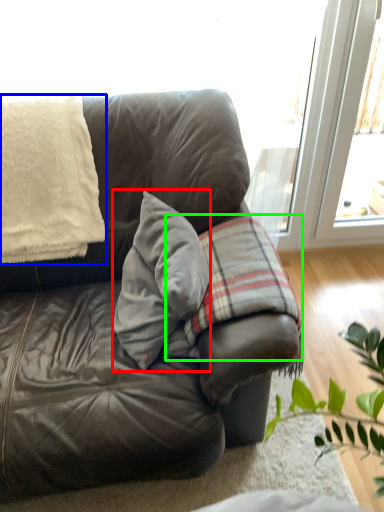
Question: Which is nearer to the throw pillow (highlighted by a red box)? blanket (highlighted by a blue box) or plaid (highlighted by a green box).

Choices:
 (A) blanket
 (B) plaid

Answer: (B)